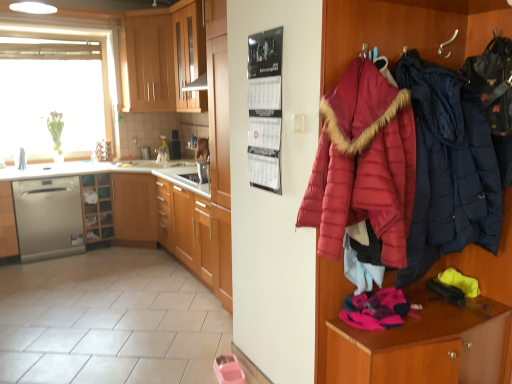
Locate an element on the screen. The width and height of the screenshot is (512, 384). matte wood dresser at right is located at coordinates (407, 30).

This screenshot has height=384, width=512. In order to click on green leafy plant at upper left in this screenshot , I will do pos(56,134).

The height and width of the screenshot is (384, 512). Describe the element at coordinates (7, 222) in the screenshot. I see `satin silver dishwasher at left, arranged as the 4th cabinetry when viewed from the right` at that location.

The image size is (512, 384). I want to click on dark blue quilted jacket at right, which is the second jacket in left-to-right order, so click(448, 168).

Identify the location of wooden shelves at lower left. This screenshot has width=512, height=384. (97, 207).

The image size is (512, 384). What are the coordinates of `matte wood dresser at right` in the screenshot? It's located at (407, 30).

Looking at this image, is wooden shelves at lower left to the left or to the right of wooden cabinets at center, marked as the first cabinetry in a right-to-left arrangement, in the image?

Clearly, wooden shelves at lower left is on the left of wooden cabinets at center, marked as the first cabinetry in a right-to-left arrangement, in the image.

Considering the relative sizes of wooden shelves at lower left and wooden cabinets at center, arranged as the 4th cabinetry when viewed from the left, in the image provided, is wooden shelves at lower left shorter than wooden cabinets at center, arranged as the 4th cabinetry when viewed from the left,?

Correct, wooden shelves at lower left is not as tall as wooden cabinets at center, arranged as the 4th cabinetry when viewed from the left.

Which object is closer to the camera, wooden shelves at lower left or wooden cabinets at center, arranged as the 4th cabinetry when viewed from the left?

Positioned in front is wooden cabinets at center, arranged as the 4th cabinetry when viewed from the left.

Is point (81, 177) positioned behind point (183, 246)?

Yes, point (81, 177) is farther from viewer.

From their relative heights in the image, would you say satin silver dishwasher at lower left is taller or shorter than matte wood dresser at right?

In the image, satin silver dishwasher at lower left appears to be shorter than matte wood dresser at right.

From the image's perspective, relative to matte wood dresser at right, is satin silver dishwasher at lower left above or below?

Based on their image positions, satin silver dishwasher at lower left is located above matte wood dresser at right.

Is matte wood dresser at right surrounded by satin silver dishwasher at lower left?

Definitely not — matte wood dresser at right is not inside satin silver dishwasher at lower left.

Looking at this image, considering the sizes of objects satin silver dishwasher at lower left and matte wood dresser at right in the image provided, who is thinner, satin silver dishwasher at lower left or matte wood dresser at right?

Thinner between the two is matte wood dresser at right.

Which is closer, (x=268, y=52) or (x=320, y=213)?

Point (x=268, y=52) appears to be farther away from the viewer than point (x=320, y=213).

Which object is closer to the camera, black paper calendar at upper center or matte red puffer jacket at right, the second jacket when ordered from right to left?

matte red puffer jacket at right, the second jacket when ordered from right to left, is closer to the camera.

Can you confirm if black paper calendar at upper center is thinner than matte red puffer jacket at right, which is counted as the first jacket, starting from the left?

Yes, black paper calendar at upper center is thinner than matte red puffer jacket at right, which is counted as the first jacket, starting from the left.

Is black paper calendar at upper center facing away from matte red puffer jacket at right, the second jacket when ordered from right to left?

No, black paper calendar at upper center is not facing away from matte red puffer jacket at right, the second jacket when ordered from right to left.

Does matte red puffer jacket at right, which is counted as the first jacket, starting from the left, have a greater height compared to wooden cabinet at upper center, acting as the 2th cabinetry starting from the right?

Incorrect, the height of matte red puffer jacket at right, which is counted as the first jacket, starting from the left, is not larger of that of wooden cabinet at upper center, acting as the 2th cabinetry starting from the right.

Considering the relative sizes of matte red puffer jacket at right, which is counted as the first jacket, starting from the left, and wooden cabinet at upper center, acting as the 2th cabinetry starting from the right, in the image provided, is matte red puffer jacket at right, which is counted as the first jacket, starting from the left, smaller than wooden cabinet at upper center, acting as the 2th cabinetry starting from the right,?

Yes.

Can you confirm if matte red puffer jacket at right, which is counted as the first jacket, starting from the left, is thinner than wooden cabinet at upper center, acting as the 2th cabinetry starting from the right?

Yes.

Is matte red puffer jacket at right, which is counted as the first jacket, starting from the left, situated inside wooden cabinet at upper center, the 3th cabinetry in the left-to-right sequence, or outside?

The correct answer is: outside.

Is satin silver dishwasher at lower left spatially inside wooden shelves at lower left, or outside of it?

satin silver dishwasher at lower left is spatially situated outside wooden shelves at lower left.

Considering the relative sizes of satin silver dishwasher at lower left and wooden shelves at lower left in the image provided, is satin silver dishwasher at lower left smaller than wooden shelves at lower left?

Actually, satin silver dishwasher at lower left might be larger than wooden shelves at lower left.

Considering the positions of point (40, 183) and point (108, 234), is point (40, 183) closer or farther from the camera than point (108, 234)?

Point (40, 183) is closer to the camera than point (108, 234).

Is the surface of matte wood dresser at right in direct contact with wooden cabinets at center, arranged as the 4th cabinetry when viewed from the left?

There is a gap between matte wood dresser at right and wooden cabinets at center, arranged as the 4th cabinetry when viewed from the left.

From the picture: Which of these two, matte wood dresser at right or wooden cabinets at center, marked as the first cabinetry in a right-to-left arrangement, is smaller?

Smaller between the two is matte wood dresser at right.

Considering the sizes of objects matte wood dresser at right and wooden cabinets at center, arranged as the 4th cabinetry when viewed from the left, in the image provided, who is shorter, matte wood dresser at right or wooden cabinets at center, arranged as the 4th cabinetry when viewed from the left,?

wooden cabinets at center, arranged as the 4th cabinetry when viewed from the left, is shorter.

Can you tell me how much matte wood dresser at right and wooden cabinets at center, arranged as the 4th cabinetry when viewed from the left, differ in facing direction?

They differ by 91.5 degrees in their facing directions.

Which of these two, satin silver dishwasher at left, arranged as the 4th cabinetry when viewed from the right, or clear glass window at upper left, is smaller?

With smaller size is satin silver dishwasher at left, arranged as the 4th cabinetry when viewed from the right.

Considering the relative positions of satin silver dishwasher at left, acting as the 1th cabinetry starting from the left, and clear glass window at upper left in the image provided, is satin silver dishwasher at left, acting as the 1th cabinetry starting from the left, to the right of clear glass window at upper left from the viewer's perspective?

In fact, satin silver dishwasher at left, acting as the 1th cabinetry starting from the left, is to the left of clear glass window at upper left.

Which is closer, (4,245) or (88,51)?

Point (4,245) is positioned closer to the camera compared to point (88,51).

Does satin silver dishwasher at left, arranged as the 4th cabinetry when viewed from the right, have a lesser height compared to clear glass window at upper left?

Correct, satin silver dishwasher at left, arranged as the 4th cabinetry when viewed from the right, is not as tall as clear glass window at upper left.

Where is `shelf on the left of wooden cabinets at center, marked as the first cabinetry in a right-to-left arrangement`? This screenshot has height=384, width=512. shelf on the left of wooden cabinets at center, marked as the first cabinetry in a right-to-left arrangement is located at coordinates (97, 207).

This screenshot has width=512, height=384. Identify the location of dresser on the right of satin silver dishwasher at lower left. (407, 30).

When comparing their distances from matte red puffer jacket at right, the second jacket when ordered from right to left, does satin silver dishwasher at lower left or clear glass window at upper left seem further?

Among the two, clear glass window at upper left is located further to matte red puffer jacket at right, the second jacket when ordered from right to left.

From the picture: Looking at the image, which one is located further to satin silver dishwasher at left, acting as the 1th cabinetry starting from the left, white glossy sink at center or wooden shelves at lower left?

The object further to satin silver dishwasher at left, acting as the 1th cabinetry starting from the left, is white glossy sink at center.

When comparing their distances from wooden shelves at lower left, does clear glass window at upper left or matte red puffer jacket at right, the second jacket when ordered from right to left, seem further?

matte red puffer jacket at right, the second jacket when ordered from right to left, is positioned further to the anchor wooden shelves at lower left.

Based on their spatial positions, is green leafy plant at upper left or dark blue quilted jacket at right, which is the 1th jacket in right-to-left order, further from wooden cabinet at upper center, the second cabinetry when ordered from left to right?

dark blue quilted jacket at right, which is the 1th jacket in right-to-left order, is positioned further to the anchor wooden cabinet at upper center, the second cabinetry when ordered from left to right.

Looking at the image, which one is located closer to wooden shelves at lower left, matte red puffer jacket at right, the second jacket when ordered from right to left, or dark blue quilted jacket at right, which is the second jacket in left-to-right order?

matte red puffer jacket at right, the second jacket when ordered from right to left, lies closer to wooden shelves at lower left than the other object.

Which object lies nearer to the anchor point satin silver dishwasher at lower left, dark blue quilted jacket at right, which is the second jacket in left-to-right order, or green leafy plant at upper left?

green leafy plant at upper left.

From the image, which object appears to be nearer to white glossy sink at center, black paper calendar at upper center or green leafy plant at upper left?

green leafy plant at upper left is closer to white glossy sink at center.

When comparing their distances from satin silver dishwasher at left, arranged as the 4th cabinetry when viewed from the right, does matte red puffer jacket at right, which is counted as the first jacket, starting from the left, or white glossy sink at center seem closer?

white glossy sink at center lies closer to satin silver dishwasher at left, arranged as the 4th cabinetry when viewed from the right, than the other object.

Locate an element on the screen. window between matte red puffer jacket at right, the second jacket when ordered from right to left, and green leafy plant at upper left in the front-back direction is located at coordinates (56, 89).

Where is `houseplant between clear glass window at upper left and satin silver dishwasher at left, arranged as the 4th cabinetry when viewed from the right, vertically`? This screenshot has height=384, width=512. houseplant between clear glass window at upper left and satin silver dishwasher at left, arranged as the 4th cabinetry when viewed from the right, vertically is located at coordinates (56, 134).

At what (x,y) coordinates should I click in order to perform the action: click on shelf between wooden cabinet at upper center, the second cabinetry when ordered from left to right, and wooden cabinets at center, arranged as the 4th cabinetry when viewed from the left, in the up-down direction. Please return your answer as a coordinate pair (x, y). The width and height of the screenshot is (512, 384). Looking at the image, I should click on (97, 207).

Locate an element on the screen. The width and height of the screenshot is (512, 384). bulletin board between matte wood dresser at right and wooden cabinets at center, marked as the first cabinetry in a right-to-left arrangement, along the z-axis is located at coordinates (265, 74).